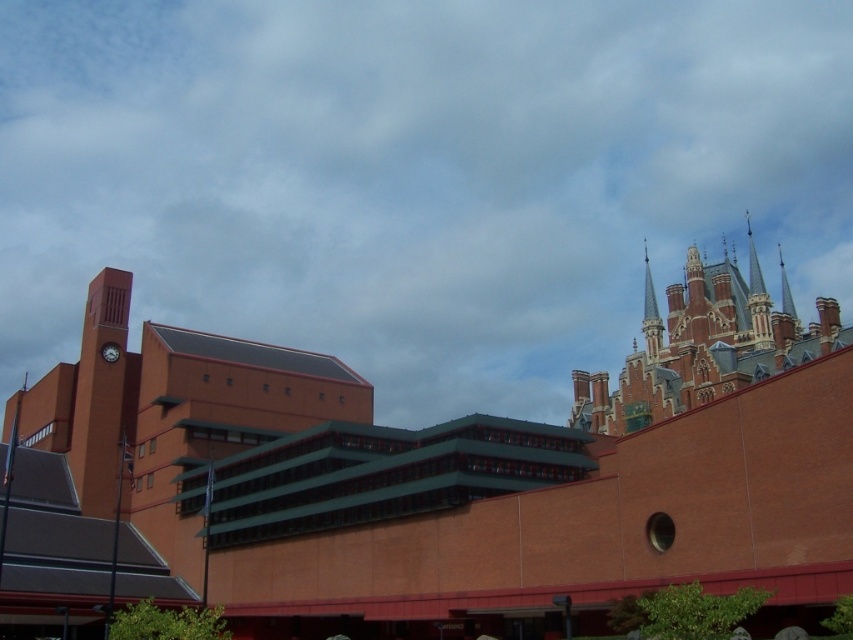
Question: Among these points, which one is farthest from the camera?

Choices:
 (A) (111, 284)
 (B) (654, 305)
 (C) (103, 353)

Answer: (B)

Question: Estimate the real-world distances between objects in this image. Which object is closer to the matte gray clock at upper left?

Choices:
 (A) smooth stone spire at upper right
 (B) matte orange clock tower at left

Answer: (B)

Question: Is matte orange clock tower at left smaller than matte gray clock at upper left?

Choices:
 (A) no
 (B) yes

Answer: (A)

Question: Is matte orange clock tower at left behind smooth stone spire at upper right?

Choices:
 (A) yes
 (B) no

Answer: (B)

Question: Does smooth stone spire at upper right appear over matte gray clock at upper left?

Choices:
 (A) no
 (B) yes

Answer: (B)

Question: Among these points, which one is farthest from the camera?

Choices:
 (A) (102, 444)
 (B) (643, 305)

Answer: (B)